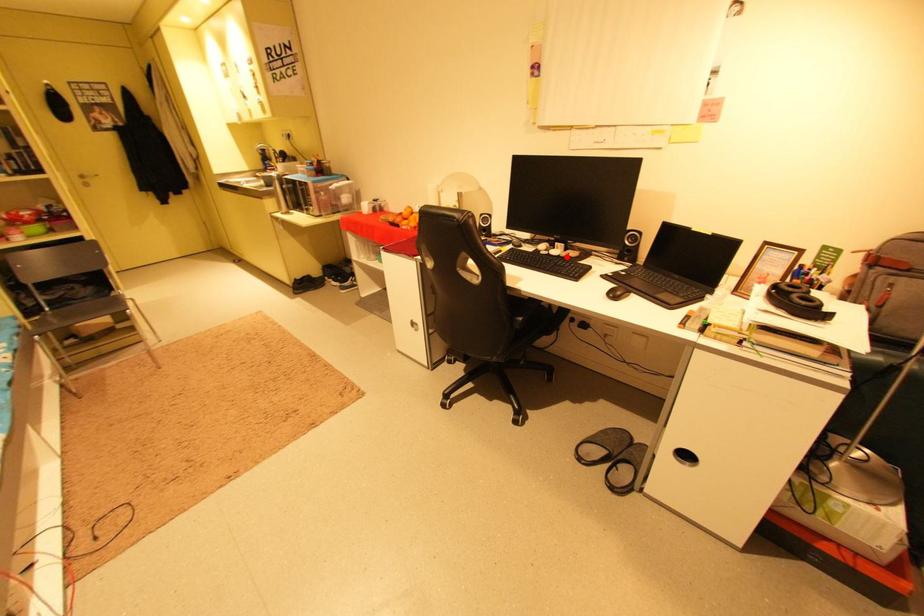
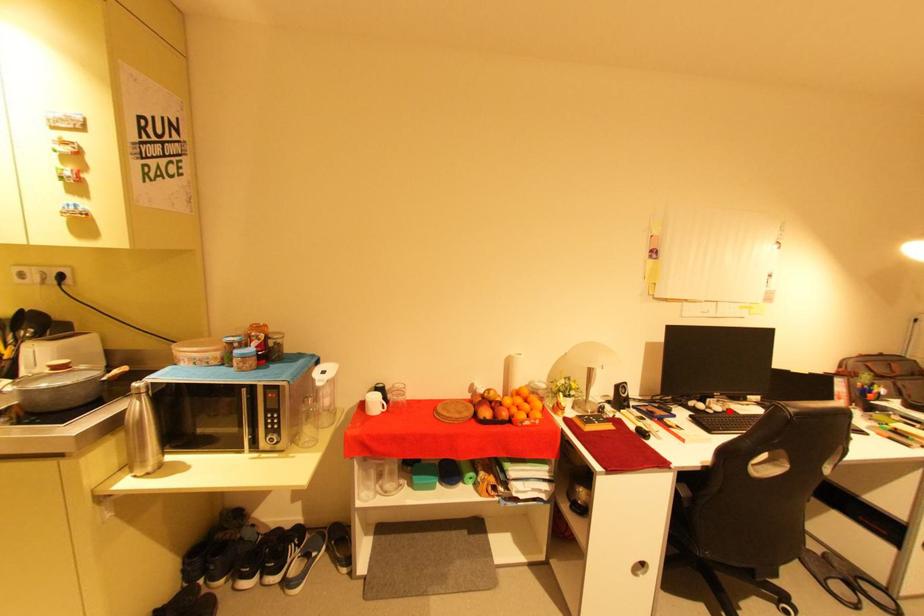
I am providing you with two images of the same scene from different viewpoints. A red point is marked on the first image and another point is marked on the second image. Is the marked point in image1 the same physical position as the marked point in image2?

Yes